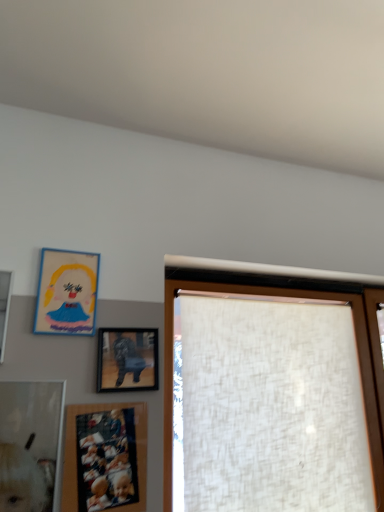
The height and width of the screenshot is (512, 384). Describe the element at coordinates (283, 297) in the screenshot. I see `white textured curtain at right` at that location.

The height and width of the screenshot is (512, 384). What do you see at coordinates (105, 457) in the screenshot? I see `matte wooden picture frame at lower left, placed as the 2th picture frame when sorted from right to left` at bounding box center [105, 457].

Image resolution: width=384 pixels, height=512 pixels. What are the coordinates of `matte wooden picture frame at upper left, arranged as the fourth picture frame when viewed from the right` in the screenshot? It's located at (4, 306).

At what (x,y) coordinates should I click in order to perform the action: click on matte black picture frame at center, which is counted as the 1th picture frame, starting from the right. Please return your answer as a coordinate pair (x, y). Looking at the image, I should click on (127, 359).

Is matte wooden picture frame at lower left, the 3th picture frame positioned from the left, facing away from white textured curtain at right?

No, white textured curtain at right is not at the back of matte wooden picture frame at lower left, the 3th picture frame positioned from the left.

Considering the sizes of objects matte wooden picture frame at lower left, placed as the 2th picture frame when sorted from right to left, and white textured curtain at right in the image provided, who is smaller, matte wooden picture frame at lower left, placed as the 2th picture frame when sorted from right to left, or white textured curtain at right?

matte wooden picture frame at lower left, placed as the 2th picture frame when sorted from right to left.

Considering the relative positions of matte wooden picture frame at lower left, the 3th picture frame positioned from the left, and white textured curtain at right in the image provided, is matte wooden picture frame at lower left, the 3th picture frame positioned from the left, behind white textured curtain at right?

No, it is not.

Considering the relative sizes of matte wooden picture frame at lower left, the 3th picture frame positioned from the left, and white textured curtain at right in the image provided, is matte wooden picture frame at lower left, the 3th picture frame positioned from the left, thinner than white textured curtain at right?

Yes, matte wooden picture frame at lower left, the 3th picture frame positioned from the left, is thinner than white textured curtain at right.

What's the angular difference between matte wooden picture frame at upper left, arranged as the fourth picture frame when viewed from the right, and matte black picture frame at center, which ranks as the 4th picture frame in left-to-right order,'s facing directions?

They differ by 0.0142 degrees in their facing directions.

Who is smaller, matte wooden picture frame at upper left, arranged as the 1th picture frame when viewed from the left, or matte black picture frame at center, which is counted as the 1th picture frame, starting from the right?

Smaller between the two is matte black picture frame at center, which is counted as the 1th picture frame, starting from the right.

From a real-world perspective, is matte wooden picture frame at upper left, arranged as the 1th picture frame when viewed from the left, under matte black picture frame at center, which ranks as the 4th picture frame in left-to-right order?

No, from a real-world perspective, matte wooden picture frame at upper left, arranged as the 1th picture frame when viewed from the left, is not beneath matte black picture frame at center, which ranks as the 4th picture frame in left-to-right order.

Is matte wooden picture frame at upper left, arranged as the 1th picture frame when viewed from the left, spatially inside matte black picture frame at center, which is counted as the 1th picture frame, starting from the right, or outside of it?

matte wooden picture frame at upper left, arranged as the 1th picture frame when viewed from the left, is located beyond the bounds of matte black picture frame at center, which is counted as the 1th picture frame, starting from the right.

Between matte wooden picture frame at lower left, the 3th picture frame positioned from the left, and matte wooden picture frame at upper left, arranged as the 1th picture frame when viewed from the left, which one has larger size?

matte wooden picture frame at lower left, the 3th picture frame positioned from the left, is bigger.

From a real-world perspective, which picture frame is the 2nd one underneath the matte wooden picture frame at upper left, arranged as the 1th picture frame when viewed from the left? Please provide its 2D coordinates.

[(105, 457)]

Which is less distant, (137, 503) or (8, 307)?

Point (137, 503) is positioned closer to the camera compared to point (8, 307).

The height and width of the screenshot is (512, 384). Identify the location of the 2nd picture frame positioned above the matte black picture frame at center, which ranks as the 4th picture frame in left-to-right order (from the image's perspective). (67, 293).

Is matte black picture frame at center, which is counted as the 1th picture frame, starting from the right, next to matte cardboard picture frame at upper left, the second picture frame viewed from the left?

No, matte black picture frame at center, which is counted as the 1th picture frame, starting from the right, is not next to matte cardboard picture frame at upper left, the second picture frame viewed from the left.

Can you confirm if matte black picture frame at center, which ranks as the 4th picture frame in left-to-right order, is positioned to the left of matte cardboard picture frame at upper left, which appears as the third picture frame when viewed from the right?

No.

Can you confirm if matte black picture frame at center, which ranks as the 4th picture frame in left-to-right order, is shorter than matte cardboard picture frame at upper left, the second picture frame viewed from the left?

Indeed, matte black picture frame at center, which ranks as the 4th picture frame in left-to-right order, has a lesser height compared to matte cardboard picture frame at upper left, the second picture frame viewed from the left.

Does matte cardboard picture frame at upper left, which appears as the third picture frame when viewed from the right, have a larger size compared to matte wooden picture frame at upper left, arranged as the 1th picture frame when viewed from the left?

Actually, matte cardboard picture frame at upper left, which appears as the third picture frame when viewed from the right, might be smaller than matte wooden picture frame at upper left, arranged as the 1th picture frame when viewed from the left.

From the image's perspective, which one is positioned higher, matte cardboard picture frame at upper left, which appears as the third picture frame when viewed from the right, or matte wooden picture frame at upper left, arranged as the fourth picture frame when viewed from the right?

From the image's view, matte cardboard picture frame at upper left, which appears as the third picture frame when viewed from the right, is above.

Which is less distant, [54,277] or [7,278]?

Positioned in front is point [7,278].

Could you tell me if matte cardboard picture frame at upper left, which appears as the third picture frame when viewed from the right, is facing matte wooden picture frame at upper left, arranged as the 1th picture frame when viewed from the left?

No, matte cardboard picture frame at upper left, which appears as the third picture frame when viewed from the right, is not oriented towards matte wooden picture frame at upper left, arranged as the 1th picture frame when viewed from the left.

Looking at this image, is matte wooden picture frame at lower left, the 3th picture frame positioned from the left, thinner than matte cardboard picture frame at upper left, the second picture frame viewed from the left?

Incorrect, the width of matte wooden picture frame at lower left, the 3th picture frame positioned from the left, is not less than that of matte cardboard picture frame at upper left, the second picture frame viewed from the left.

From the image's perspective, which is below, matte wooden picture frame at lower left, placed as the 2th picture frame when sorted from right to left, or matte cardboard picture frame at upper left, which appears as the third picture frame when viewed from the right?

From the image's view, matte wooden picture frame at lower left, placed as the 2th picture frame when sorted from right to left, is below.

Is matte wooden picture frame at lower left, the 3th picture frame positioned from the left, situated inside matte cardboard picture frame at upper left, the second picture frame viewed from the left, or outside?

matte wooden picture frame at lower left, the 3th picture frame positioned from the left, is located beyond the bounds of matte cardboard picture frame at upper left, the second picture frame viewed from the left.

Is matte black picture frame at center, which ranks as the 4th picture frame in left-to-right order, taller than white textured curtain at right?

In fact, matte black picture frame at center, which ranks as the 4th picture frame in left-to-right order, may be shorter than white textured curtain at right.

Which object is positioned more to the left, matte black picture frame at center, which ranks as the 4th picture frame in left-to-right order, or white textured curtain at right?

From the viewer's perspective, matte black picture frame at center, which ranks as the 4th picture frame in left-to-right order, appears more on the left side.

Are matte black picture frame at center, which ranks as the 4th picture frame in left-to-right order, and white textured curtain at right making contact?

No, matte black picture frame at center, which ranks as the 4th picture frame in left-to-right order, is not next to white textured curtain at right.

Where is `window that is behind the matte wooden picture frame at lower left, the 3th picture frame positioned from the left`? This screenshot has height=512, width=384. window that is behind the matte wooden picture frame at lower left, the 3th picture frame positioned from the left is located at coordinates (283, 297).

Where is `the 3rd picture frame counting from the left of the matte black picture frame at center, which is counted as the 1th picture frame, starting from the right`? the 3rd picture frame counting from the left of the matte black picture frame at center, which is counted as the 1th picture frame, starting from the right is located at coordinates (4, 306).

From the image, which object appears to be nearer to matte wooden picture frame at lower left, the 3th picture frame positioned from the left, matte cardboard picture frame at upper left, which appears as the third picture frame when viewed from the right, or matte black picture frame at center, which is counted as the 1th picture frame, starting from the right?

The object closer to matte wooden picture frame at lower left, the 3th picture frame positioned from the left, is matte black picture frame at center, which is counted as the 1th picture frame, starting from the right.

Based on their spatial positions, is matte wooden picture frame at lower left, placed as the 2th picture frame when sorted from right to left, or matte black picture frame at center, which ranks as the 4th picture frame in left-to-right order, closer to matte cardboard picture frame at upper left, the second picture frame viewed from the left?

matte black picture frame at center, which ranks as the 4th picture frame in left-to-right order, lies closer to matte cardboard picture frame at upper left, the second picture frame viewed from the left, than the other object.

Estimate the real-world distances between objects in this image. Which object is closer to matte wooden picture frame at upper left, arranged as the 1th picture frame when viewed from the left, matte wooden picture frame at lower left, placed as the 2th picture frame when sorted from right to left, or matte black picture frame at center, which is counted as the 1th picture frame, starting from the right?

matte black picture frame at center, which is counted as the 1th picture frame, starting from the right, is closer to matte wooden picture frame at upper left, arranged as the 1th picture frame when viewed from the left.

Based on their spatial positions, is matte wooden picture frame at upper left, arranged as the fourth picture frame when viewed from the right, or matte wooden picture frame at lower left, placed as the 2th picture frame when sorted from right to left, further from white textured curtain at right?

matte wooden picture frame at upper left, arranged as the fourth picture frame when viewed from the right, lies further to white textured curtain at right than the other object.

Based on the photo, when comparing their distances from matte wooden picture frame at upper left, arranged as the 1th picture frame when viewed from the left, does matte cardboard picture frame at upper left, which appears as the third picture frame when viewed from the right, or white textured curtain at right seem closer?

matte cardboard picture frame at upper left, which appears as the third picture frame when viewed from the right, is closer to matte wooden picture frame at upper left, arranged as the 1th picture frame when viewed from the left.

When comparing their distances from white textured curtain at right, does matte black picture frame at center, which ranks as the 4th picture frame in left-to-right order, or matte wooden picture frame at upper left, arranged as the 1th picture frame when viewed from the left, seem closer?

matte black picture frame at center, which ranks as the 4th picture frame in left-to-right order, is closer to white textured curtain at right.

Based on their spatial positions, is matte wooden picture frame at upper left, arranged as the fourth picture frame when viewed from the right, or matte black picture frame at center, which ranks as the 4th picture frame in left-to-right order, closer to matte wooden picture frame at lower left, the 3th picture frame positioned from the left?

Among the two, matte black picture frame at center, which ranks as the 4th picture frame in left-to-right order, is located nearer to matte wooden picture frame at lower left, the 3th picture frame positioned from the left.

Considering their positions, is matte cardboard picture frame at upper left, the second picture frame viewed from the left, positioned closer to matte wooden picture frame at upper left, arranged as the 1th picture frame when viewed from the left, than matte wooden picture frame at lower left, placed as the 2th picture frame when sorted from right to left?

The object closer to matte wooden picture frame at upper left, arranged as the 1th picture frame when viewed from the left, is matte cardboard picture frame at upper left, the second picture frame viewed from the left.

The image size is (384, 512). In order to click on picture frame located between matte wooden picture frame at lower left, placed as the 2th picture frame when sorted from right to left, and white textured curtain at right in the left-right direction in this screenshot , I will do [127, 359].